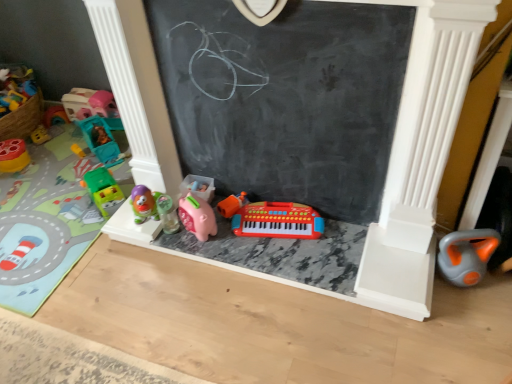
At what (x,y) coordinates should I click in order to perform the action: click on blank space above black chalkboard at center (from a real-world perspective). Please return your answer as a coordinate pair (x, y). The width and height of the screenshot is (512, 384). Looking at the image, I should click on (295, 2).